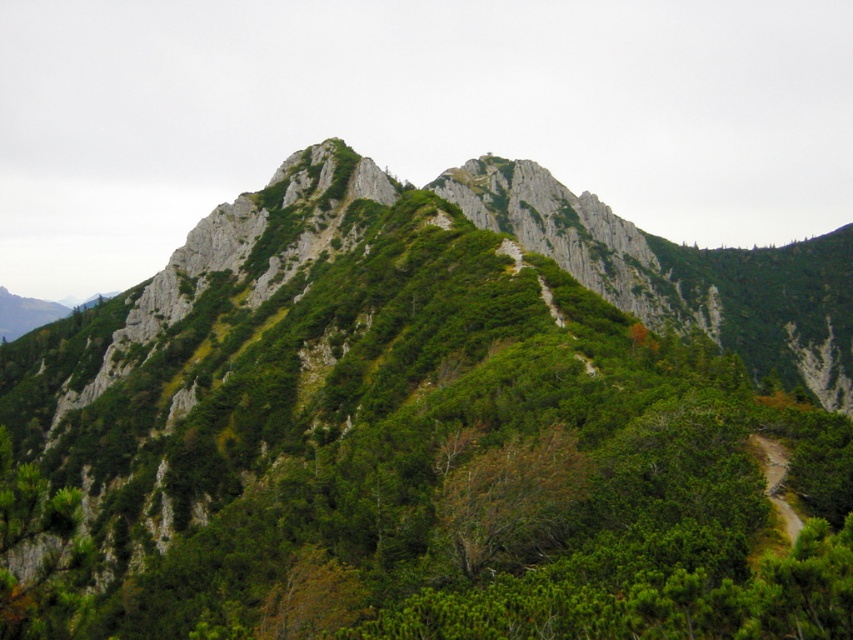
Does point (548, 538) come behind point (772, 497)?

No.

Can you confirm if brown leafy tree at center is positioned to the right of brown dirt path at lower right?

In fact, brown leafy tree at center is to the left of brown dirt path at lower right.

Which is in front, point (448, 544) or point (793, 532)?

Positioned in front is point (793, 532).

Identify the location of brown leafy tree at center. The image size is (853, 640). (511, 499).